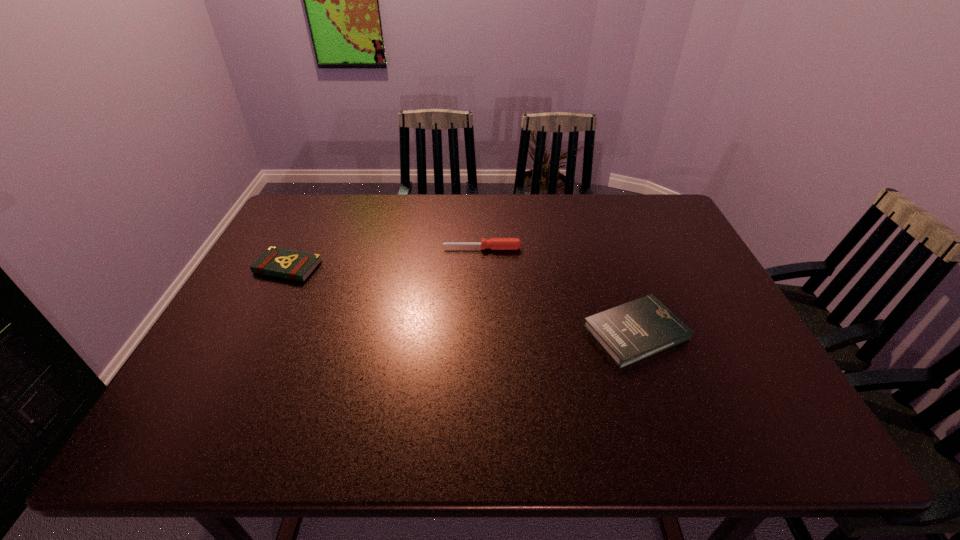
Find the location of a particular element. object that is at the right edge is located at coordinates (630, 332).

Find the location of a particular element. free point at the far edge is located at coordinates (612, 201).

This screenshot has height=540, width=960. Find the location of `blank space at the near edge of the desktop`. blank space at the near edge of the desktop is located at coordinates (693, 426).

The height and width of the screenshot is (540, 960). Identify the location of vacant space at the left edge. (262, 293).

I want to click on blank area at the right edge, so click(x=696, y=367).

Where is `free space at the far left corner`? free space at the far left corner is located at coordinates (282, 233).

Where is `free space between the farther book and the second object from right to left`? The image size is (960, 540). free space between the farther book and the second object from right to left is located at coordinates (385, 258).

I want to click on free space between the leftmost object and the right book, so [462, 300].

At what (x,y) coordinates should I click in order to perform the action: click on vacant space that's between the nearest object and the second farthest object. Please return your answer as a coordinate pair (x, y). The height and width of the screenshot is (540, 960). Looking at the image, I should click on (462, 300).

The image size is (960, 540). What are the coordinates of `empty space between the second nearest object and the nearest object` in the screenshot? It's located at (462, 300).